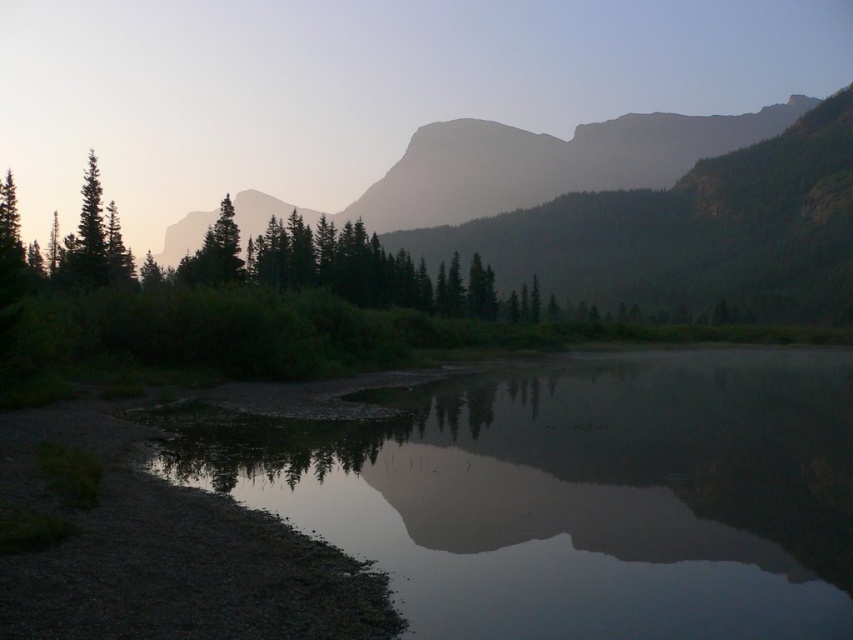
Can you confirm if silvery gray rock at upper center is bigger than green matte tree at left?

Correct, silvery gray rock at upper center is larger in size than green matte tree at left.

Between silvery gray rock at upper center and green matte tree at left, which one is positioned higher?

Positioned higher is silvery gray rock at upper center.

Who is more distant from viewer, (763, 248) or (84, 173)?

Positioned behind is point (763, 248).

Identify the location of silvery gray rock at upper center. The image size is (853, 640). (639, 205).

Does point (689, 451) come closer to viewer compared to point (74, 262)?

Yes, it is.

Where is `smooth reflective water at center`? smooth reflective water at center is located at coordinates (578, 496).

Is point (775, 534) behind point (111, 225)?

That is False.

Locate an element on the screen. smooth reflective water at center is located at coordinates (578, 496).

Is point (653, 545) closer to camera compared to point (587, 253)?

That is True.

Can you confirm if smooth reflective water at center is wider than silvery gray rock at upper center?

In fact, smooth reflective water at center might be narrower than silvery gray rock at upper center.

Who is more forward, (512, 476) or (434, 225)?

Point (512, 476) is more forward.

At what (x,y) coordinates should I click in order to perform the action: click on smooth reflective water at center. Please return your answer as a coordinate pair (x, y). Looking at the image, I should click on (578, 496).